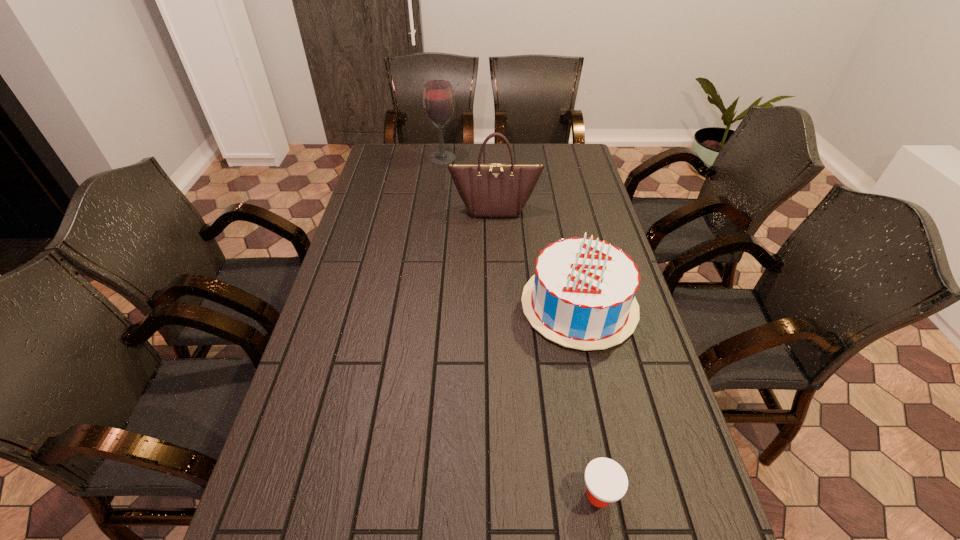
Locate an element on the screen. vacant region that satisfies the following two spatial constraints: 1. on the front-facing side of the handbag; 2. on the left side of the third tallest object is located at coordinates (498, 306).

This screenshot has width=960, height=540. Identify the location of free spot that satisfies the following two spatial constraints: 1. on the front-facing side of the birthday cake; 2. on the left side of the handbag. (498, 306).